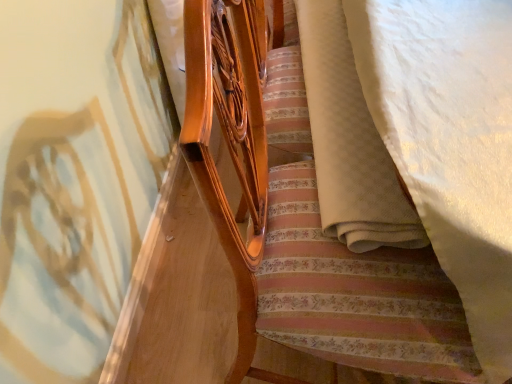
Locate an element on the screen. white textured blanket at lower right is located at coordinates (349, 141).

Describe the element at coordinates (349, 141) in the screenshot. Image resolution: width=512 pixels, height=384 pixels. I see `white textured blanket at lower right` at that location.

Image resolution: width=512 pixels, height=384 pixels. What do you see at coordinates (376, 184) in the screenshot?
I see `matte wood bed frame at center` at bounding box center [376, 184].

The width and height of the screenshot is (512, 384). I want to click on matte wood bed frame at center, so click(376, 184).

The height and width of the screenshot is (384, 512). Identify the location of white textured blanket at lower right. (349, 141).

Considering the relative positions of white textured blanket at lower right and matte wood bed frame at center in the image provided, is white textured blanket at lower right to the left or to the right of matte wood bed frame at center?

Based on their positions, white textured blanket at lower right is located to the right of matte wood bed frame at center.

Is the position of white textured blanket at lower right more distant than that of matte wood bed frame at center?

Yes, it is.

Does point (340, 79) appear closer or farther from the camera than point (504, 25)?

Point (340, 79) is farther from the camera than point (504, 25).

From the image's perspective, which object appears higher, white textured blanket at lower right or matte wood bed frame at center?

white textured blanket at lower right is shown above in the image.

From a real-world perspective, is white textured blanket at lower right above or below matte wood bed frame at center?

In terms of real-world spatial position, white textured blanket at lower right is above matte wood bed frame at center.

Does white textured blanket at lower right have a greater width compared to matte wood bed frame at center?

No, white textured blanket at lower right is not wider than matte wood bed frame at center.

Considering the sizes of objects white textured blanket at lower right and matte wood bed frame at center in the image provided, who is shorter, white textured blanket at lower right or matte wood bed frame at center?

white textured blanket at lower right is shorter.

Who is smaller, white textured blanket at lower right or matte wood bed frame at center?

white textured blanket at lower right is smaller.

Is white textured blanket at lower right positioned beyond the bounds of matte wood bed frame at center?

No, white textured blanket at lower right is not entirely external to matte wood bed frame at center.

Consider the image. Is white textured blanket at lower right far from matte wood bed frame at center?

They are positioned close to each other.

Consider the image. Could you tell me if white textured blanket at lower right is turned towards matte wood bed frame at center?

No, white textured blanket at lower right is not aimed at matte wood bed frame at center.

How different are the orientations of white textured blanket at lower right and matte wood bed frame at center in degrees?

The angular difference between white textured blanket at lower right and matte wood bed frame at center is 3.37 degrees.

This screenshot has width=512, height=384. Find the location of `furniture on the left of white textured blanket at lower right`. furniture on the left of white textured blanket at lower right is located at coordinates (376, 184).

Is matte wood bed frame at center to the left of white textured blanket at lower right from the viewer's perspective?

Yes.

Which object is further away from the camera, matte wood bed frame at center or white textured blanket at lower right?

white textured blanket at lower right.

Is point (507, 116) farther from viewer compared to point (339, 133)?

No.

From the picture: From the image's perspective, relative to white textured blanket at lower right, is matte wood bed frame at center above or below?

Clearly, from the image's perspective, matte wood bed frame at center is below white textured blanket at lower right.

Based on the photo, from a real-world perspective, which is physically below, matte wood bed frame at center or white textured blanket at lower right?

matte wood bed frame at center.

Considering the sizes of objects matte wood bed frame at center and white textured blanket at lower right in the image provided, who is thinner, matte wood bed frame at center or white textured blanket at lower right?

white textured blanket at lower right is thinner.

Who is shorter, matte wood bed frame at center or white textured blanket at lower right?

With less height is white textured blanket at lower right.

Which of these two, matte wood bed frame at center or white textured blanket at lower right, is bigger?

matte wood bed frame at center.

Based on the photo, is matte wood bed frame at center inside or outside of white textured blanket at lower right?

matte wood bed frame at center cannot be found inside white textured blanket at lower right.

Are matte wood bed frame at center and white textured blanket at lower right making contact?

No, matte wood bed frame at center is not touching white textured blanket at lower right.

Is matte wood bed frame at center facing towards white textured blanket at lower right?

Yes, matte wood bed frame at center is oriented towards white textured blanket at lower right.

How different are the orientations of matte wood bed frame at center and white textured blanket at lower right in degrees?

The angular difference between matte wood bed frame at center and white textured blanket at lower right is 3.37 degrees.

Where is `blanket that is above the matte wood bed frame at center (from the image's perspective)`? This screenshot has width=512, height=384. blanket that is above the matte wood bed frame at center (from the image's perspective) is located at coordinates (349, 141).

In order to click on blanket on the right of matte wood bed frame at center in this screenshot , I will do `click(349, 141)`.

Locate an element on the screen. The height and width of the screenshot is (384, 512). blanket positioned vertically above the matte wood bed frame at center (from a real-world perspective) is located at coordinates (349, 141).